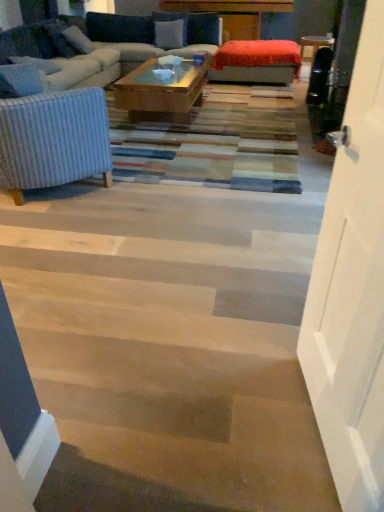
The image size is (384, 512). Find the location of `vacant point to the left of white wood door at right`. vacant point to the left of white wood door at right is located at coordinates (214, 410).